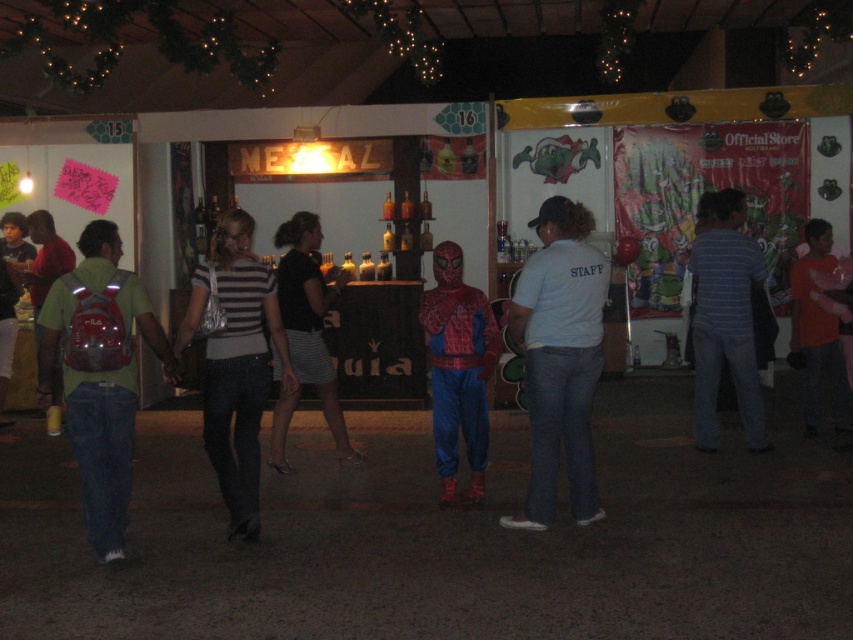
Question: Is matte red backpack at left positioned behind striped fabric skirt at center?

Choices:
 (A) no
 (B) yes

Answer: (A)

Question: Which of the following is the farthest from the observer?

Choices:
 (A) orange cotton shirt at right
 (B) white cotton shirt at center
 (C) blue striped shirt at right
 (D) striped knit sweater at center

Answer: (A)

Question: Can you confirm if matte red backpack at left is thinner than blue striped shirt at right?

Choices:
 (A) yes
 (B) no

Answer: (B)

Question: Based on their relative distances, which object is farther from the orange cotton shirt at right?

Choices:
 (A) shiny spandex suit at center
 (B) striped fabric skirt at center
 (C) blue striped shirt at right

Answer: (B)

Question: Which is farther from the striped knit sweater at center?

Choices:
 (A) striped fabric skirt at center
 (B) matte red backpack at left
 (C) blue striped shirt at right
 (D) white cotton shirt at center

Answer: (C)

Question: Is blue striped shirt at right below orange cotton shirt at right?

Choices:
 (A) no
 (B) yes

Answer: (A)